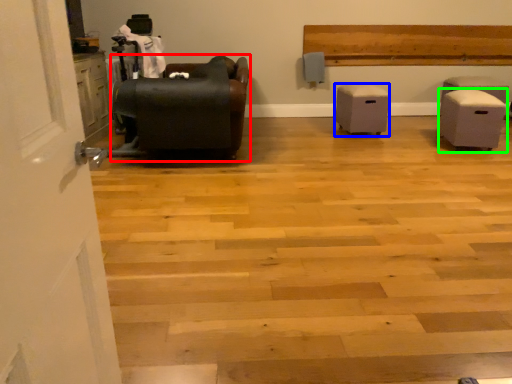
Question: Which object is positioned closest to furniture (highlighted by a red box)? Select from furniture (highlighted by a blue box) and furniture (highlighted by a green box).

Choices:
 (A) furniture
 (B) furniture

Answer: (A)